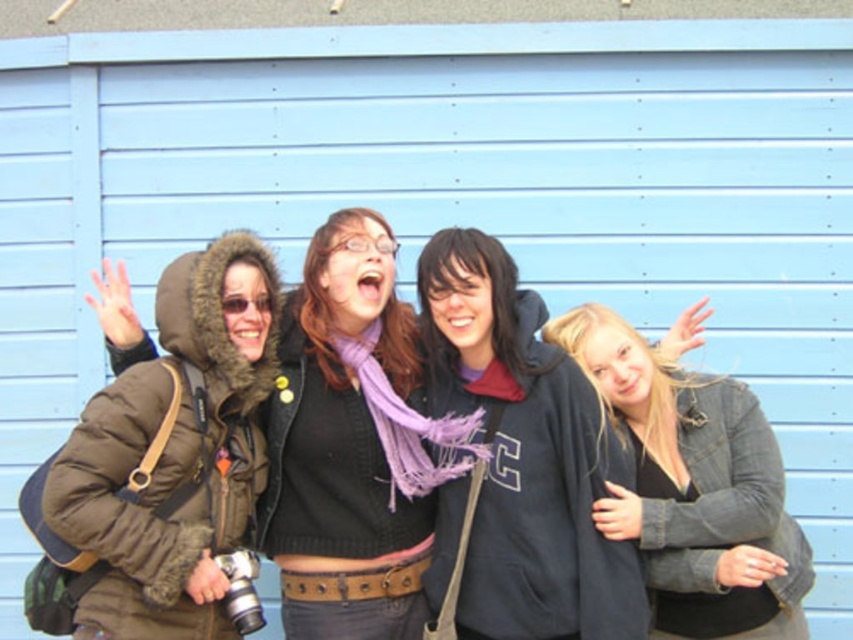
Question: Can you confirm if dark gray hoodie at center is bigger than matte brown jacket at left?

Choices:
 (A) yes
 (B) no

Answer: (B)

Question: Estimate the real-world distances between objects in this image. Which object is farther from the matte brown jacket at left?

Choices:
 (A) dark gray hoodie at center
 (B) blonde hair at right

Answer: (B)

Question: Where is matte brown jacket at left located in relation to blonde hair at right in the image?

Choices:
 (A) right
 (B) left

Answer: (B)

Question: Which object is the closest to the matte brown jacket at left?

Choices:
 (A) blonde hair at right
 (B) dark gray hoodie at center

Answer: (B)

Question: Estimate the real-world distances between objects in this image. Which object is farther from the blonde hair at right?

Choices:
 (A) dark gray hoodie at center
 (B) matte brown jacket at left

Answer: (B)

Question: Does dark gray hoodie at center appear on the right side of blonde hair at right?

Choices:
 (A) yes
 (B) no

Answer: (B)